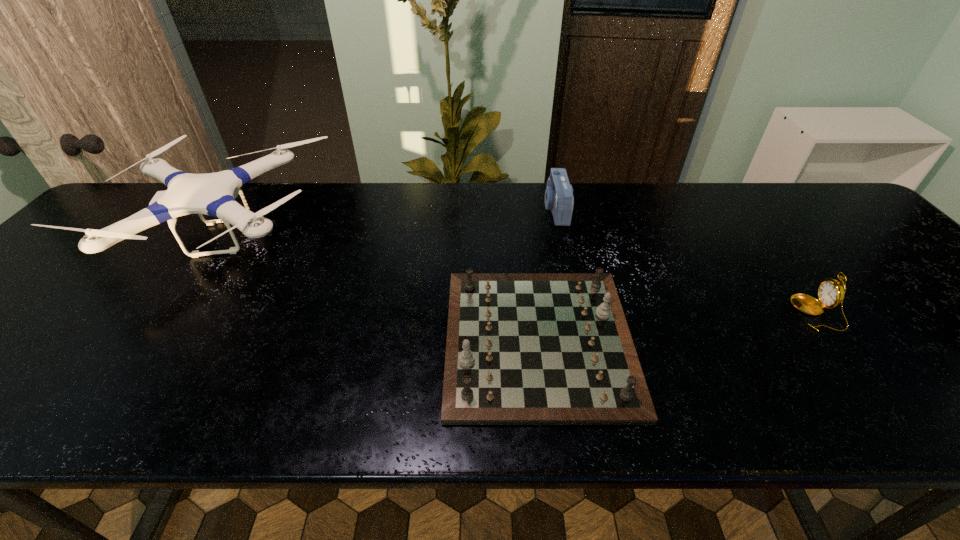
This screenshot has width=960, height=540. I want to click on free spot at the far edge of the desktop, so click(381, 191).

Locate an element on the screen. The height and width of the screenshot is (540, 960). vacant area at the near edge of the desktop is located at coordinates (133, 385).

In order to click on vacant space at the left edge of the desktop in this screenshot , I will do `click(56, 289)`.

Find the location of `free space at the right edge of the desktop`. free space at the right edge of the desktop is located at coordinates (910, 289).

Find the location of a particular element. vacant space at the far right corner of the desktop is located at coordinates (853, 214).

In order to click on unoccupied area between the shortest object and the drone in this screenshot , I will do `click(380, 288)`.

Find the location of a particular element. vacant area that lies between the rightmost object and the camera is located at coordinates (685, 261).

The width and height of the screenshot is (960, 540). I want to click on free space between the shortest object and the pocket watch, so click(677, 327).

Locate an element on the screen. Image resolution: width=960 pixels, height=540 pixels. free space between the leftmost object and the chessboard is located at coordinates (380, 288).

Identify the location of vacant area that lies between the rightmost object and the chessboard. (677, 327).